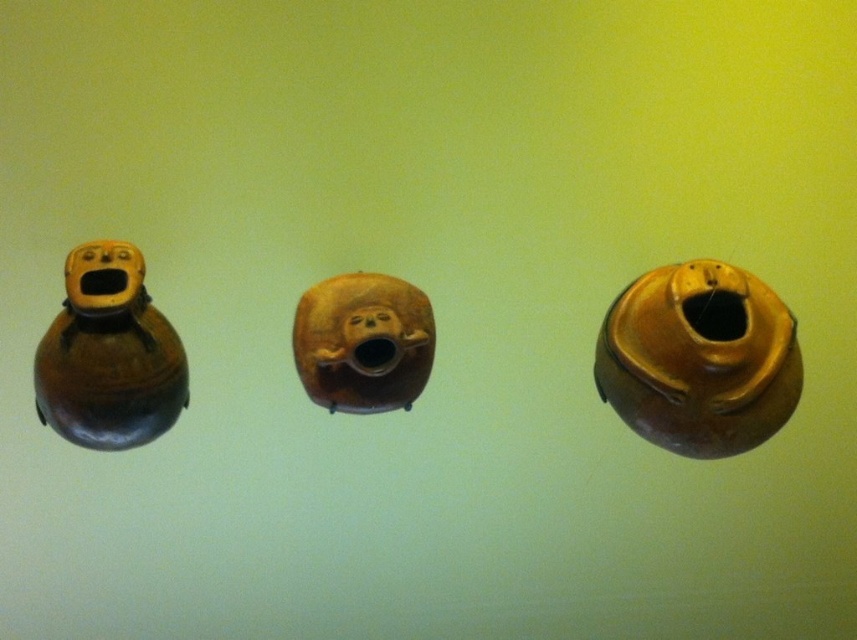
Question: Can you confirm if matte brown vase at left is positioned above brown matte monkey head at center?

Choices:
 (A) no
 (B) yes

Answer: (A)

Question: Which point is farther to the camera?

Choices:
 (A) matte brown vase at left
 (B) brown matte monkey head at center

Answer: (B)

Question: Among these objects, which one is nearest to the camera?

Choices:
 (A) matte brown vase at center
 (B) matte brown vase at left
 (C) brown matte monkey head at center

Answer: (B)

Question: Considering the relative positions of matte brown vase at center and matte brown vase at left in the image provided, where is matte brown vase at center located with respect to matte brown vase at left?

Choices:
 (A) right
 (B) left

Answer: (A)

Question: Does matte brown vase at center have a smaller size compared to matte brown vase at left?

Choices:
 (A) no
 (B) yes

Answer: (A)

Question: Among these points, which one is farthest from the camera?

Choices:
 (A) (771, 337)
 (B) (364, 387)
 (C) (58, 371)

Answer: (B)